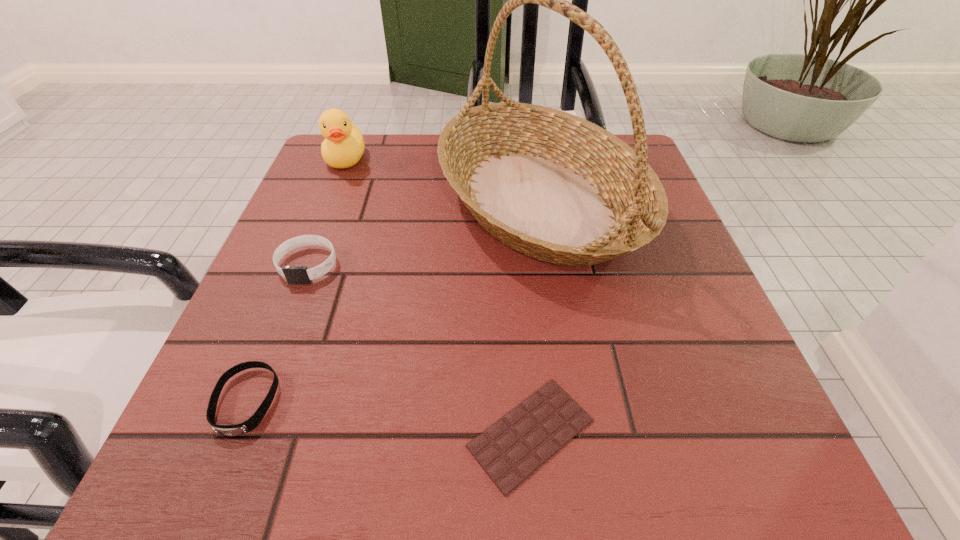
Image resolution: width=960 pixels, height=540 pixels. What are the coordinates of `empty space that is in between the chocolate bar and the duck` in the screenshot? It's located at (438, 296).

This screenshot has width=960, height=540. Identify the location of vacant space that's between the duck and the chocolate bar. (438, 296).

Where is `vacant point located between the shortest object and the second shortest object`? vacant point located between the shortest object and the second shortest object is located at coordinates (389, 417).

At what (x,y) coordinates should I click in order to perform the action: click on free spot between the nearer wristband and the farther wristband. Please return your answer as a coordinate pair (x, y). Looking at the image, I should click on (276, 333).

Identify the location of vacant area that lies between the shorter wristband and the chocolate bar. (389, 417).

Where is `vacant area between the chocolate bar and the duck`? The image size is (960, 540). vacant area between the chocolate bar and the duck is located at coordinates (438, 296).

What are the coordinates of `object identified as the fourth closest to the farther wristband` in the screenshot? It's located at (510, 450).

Select which object is the second closest to the chocolate bar. Please provide its 2D coordinates. Your answer should be formatted as a tuple, i.e. [(x, y)], where the tuple contains the x and y coordinates of a point satisfying the conditions above.

[(227, 430)]

Identify the location of free space that satisfies the following two spatial constraints: 1. at the beak of the duck; 2. on the left side of the shortest object. Image resolution: width=960 pixels, height=540 pixels. (237, 433).

Where is `free space in the image that satisfies the following two spatial constraints: 1. at the beak of the second tallest object; 2. on the right side of the chocolate bar`? free space in the image that satisfies the following two spatial constraints: 1. at the beak of the second tallest object; 2. on the right side of the chocolate bar is located at coordinates (237, 433).